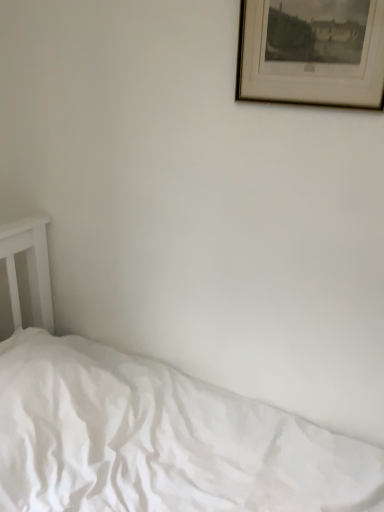
Image resolution: width=384 pixels, height=512 pixels. Identify the location of wooden picture frame at upper right. (310, 56).

What do you see at coordinates (310, 56) in the screenshot? This screenshot has height=512, width=384. I see `wooden picture frame at upper right` at bounding box center [310, 56].

Where is `white cotton bed at lower left`? Image resolution: width=384 pixels, height=512 pixels. white cotton bed at lower left is located at coordinates (150, 426).

What do you see at coordinates (150, 426) in the screenshot? I see `white cotton bed at lower left` at bounding box center [150, 426].

This screenshot has height=512, width=384. I want to click on wooden picture frame at upper right, so click(x=310, y=56).

Is white cotton bed at lower left to the left or to the right of wooden picture frame at upper right in the image?

From the image, it's evident that white cotton bed at lower left is to the left of wooden picture frame at upper right.

Between white cotton bed at lower left and wooden picture frame at upper right, which one is positioned behind?

Positioned behind is wooden picture frame at upper right.

Does point (50, 291) come behind point (315, 54)?

Yes.

From the image's perspective, is white cotton bed at lower left located beneath wooden picture frame at upper right?

Yes, from the image's perspective, white cotton bed at lower left is beneath wooden picture frame at upper right.

From a real-world perspective, is white cotton bed at lower left on top of wooden picture frame at upper right?

Incorrect, from a real-world perspective, white cotton bed at lower left is lower than wooden picture frame at upper right.

Does white cotton bed at lower left have a greater width compared to wooden picture frame at upper right?

Yes, white cotton bed at lower left is wider than wooden picture frame at upper right.

Considering the sizes of white cotton bed at lower left and wooden picture frame at upper right in the image, is white cotton bed at lower left taller or shorter than wooden picture frame at upper right?

Clearly, white cotton bed at lower left is taller compared to wooden picture frame at upper right.

Which of these two, white cotton bed at lower left or wooden picture frame at upper right, is bigger?

Bigger between the two is white cotton bed at lower left.

Would you say wooden picture frame at upper right is part of white cotton bed at lower left's contents?

No.

Would you say white cotton bed at lower left is a long distance from wooden picture frame at upper right?

That's right, there is a large distance between white cotton bed at lower left and wooden picture frame at upper right.

Does white cotton bed at lower left turn towards wooden picture frame at upper right?

No, white cotton bed at lower left is not aimed at wooden picture frame at upper right.

Can you tell me how much white cotton bed at lower left and wooden picture frame at upper right differ in facing direction?

They differ by 88.8 degrees in their facing directions.

The image size is (384, 512). I want to click on bed on the left of wooden picture frame at upper right, so click(150, 426).

Which object is positioned more to the left, wooden picture frame at upper right or white cotton bed at lower left?

white cotton bed at lower left is more to the left.

Which object is closer to the camera, wooden picture frame at upper right or white cotton bed at lower left?

white cotton bed at lower left.

Between point (311, 68) and point (282, 499), which one is positioned behind?

The point (282, 499) is behind.

From the image's perspective, is wooden picture frame at upper right on white cotton bed at lower left?

Yes, from the image's perspective, wooden picture frame at upper right is above white cotton bed at lower left.

From a real-world perspective, is wooden picture frame at upper right on top of white cotton bed at lower left?

Indeed, from a real-world perspective, wooden picture frame at upper right stands above white cotton bed at lower left.

Can you confirm if wooden picture frame at upper right is wider than white cotton bed at lower left?

Incorrect, the width of wooden picture frame at upper right does not surpass that of white cotton bed at lower left.

Who is shorter, wooden picture frame at upper right or white cotton bed at lower left?

With less height is wooden picture frame at upper right.

Considering the relative sizes of wooden picture frame at upper right and white cotton bed at lower left in the image provided, is wooden picture frame at upper right smaller than white cotton bed at lower left?

Yes.

Would you say wooden picture frame at upper right contains white cotton bed at lower left?

No, white cotton bed at lower left is located outside of wooden picture frame at upper right.

Are wooden picture frame at upper right and white cotton bed at lower left beside each other?

wooden picture frame at upper right is not next to white cotton bed at lower left, and they're not touching.

Is wooden picture frame at upper right looking in the opposite direction of white cotton bed at lower left?

wooden picture frame at upper right is not turned away from white cotton bed at lower left.

What's the angular difference between wooden picture frame at upper right and white cotton bed at lower left's facing directions?

wooden picture frame at upper right and white cotton bed at lower left are facing 88.8 degrees away from each other.

Measure the distance from wooden picture frame at upper right to white cotton bed at lower left.

wooden picture frame at upper right is 3.31 feet from white cotton bed at lower left.

The height and width of the screenshot is (512, 384). I want to click on picture frame above the white cotton bed at lower left (from the image's perspective), so click(x=310, y=56).

You are a GUI agent. You are given a task and a screenshot of the screen. Output one action in this format:
    pyautogui.click(x=<x>, y=<y>)
    Task: Click on the picture frame lying above the white cotton bed at lower left (from the image's perspective)
    The height and width of the screenshot is (512, 384).
    Given the screenshot: What is the action you would take?
    pyautogui.click(x=310, y=56)

In the image, there is a wooden picture frame at upper right. Where is `bed below it (from a real-world perspective)`? bed below it (from a real-world perspective) is located at coordinates (150, 426).